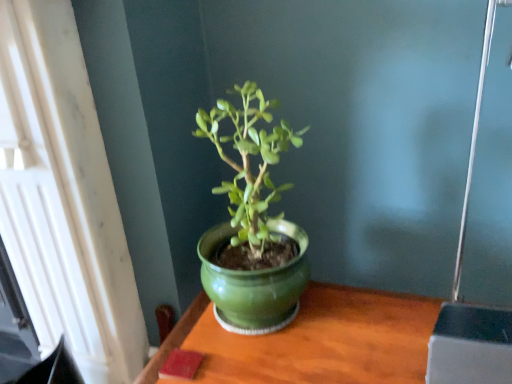
I want to click on glossy ceramic pot at center, so click(252, 225).

What are the coordinates of `glossy ceramic pot at center` in the screenshot? It's located at (252, 225).

From a real-world perspective, is white textured window at upper left above or below green ceramic table at center?

white textured window at upper left is above green ceramic table at center.

Could you tell me if white textured window at upper left is turned towards green ceramic table at center?

No, white textured window at upper left is not turned towards green ceramic table at center.

Is point (57, 115) more distant than point (419, 366)?

Yes, point (57, 115) is behind point (419, 366).

Would you say white textured window at upper left contains green ceramic table at center?

No, green ceramic table at center is located outside of white textured window at upper left.

Is glossy ceramic pot at center positioned beyond the bounds of white textured window at upper left?

glossy ceramic pot at center is positioned outside white textured window at upper left.

Which is in front, glossy ceramic pot at center or white textured window at upper left?

white textured window at upper left.

Is glossy ceramic pot at center not close to white textured window at upper left?

No.

Considering the sizes of glossy ceramic pot at center and white textured window at upper left in the image, is glossy ceramic pot at center taller or shorter than white textured window at upper left?

Considering their sizes, glossy ceramic pot at center has less height than white textured window at upper left.

Where is `houseplant that appears above the green ceramic table at center (from the image's perspective)`? houseplant that appears above the green ceramic table at center (from the image's perspective) is located at coordinates (252, 225).

Based on their positions, is glossy ceramic pot at center located to the left or right of green ceramic table at center?

glossy ceramic pot at center is positioned on green ceramic table at center's left side.

Which is further, (210,139) or (319,300)?

The point (319,300) is farther from the camera.

Is green ceramic table at center surrounded by glossy ceramic pot at center?

No, glossy ceramic pot at center does not contain green ceramic table at center.

Is glossy ceramic pot at center inside green ceramic table at center?

No, green ceramic table at center does not contain glossy ceramic pot at center.

From a real-world perspective, which is physically above, green ceramic table at center or glossy ceramic pot at center?

From a 3D spatial view, glossy ceramic pot at center is above.

From the image's perspective, between green ceramic table at center and glossy ceramic pot at center, which one is located above?

glossy ceramic pot at center, from the image's perspective.

How many degrees apart are the facing directions of green ceramic table at center and glossy ceramic pot at center?

The angular difference between green ceramic table at center and glossy ceramic pot at center is 0.811 degrees.

Can you see white textured window at upper left touching glossy ceramic pot at center?

There is a gap between white textured window at upper left and glossy ceramic pot at center.

Which object is wider, white textured window at upper left or glossy ceramic pot at center?

With larger width is white textured window at upper left.

Locate an element on the screen. window in front of the glossy ceramic pot at center is located at coordinates (63, 197).

Is green ceramic table at center facing away from white textured window at upper left?

green ceramic table at center does not have its back to white textured window at upper left.

How different are the orientations of green ceramic table at center and white textured window at upper left in degrees?

The facing directions of green ceramic table at center and white textured window at upper left are 0.0884 degrees apart.

Is green ceramic table at center in contact with white textured window at upper left?

green ceramic table at center and white textured window at upper left are clearly separated.

Where is `window positioned vertically above the green ceramic table at center (from a real-world perspective)`? The image size is (512, 384). window positioned vertically above the green ceramic table at center (from a real-world perspective) is located at coordinates (63, 197).

This screenshot has height=384, width=512. In order to click on window located above the green ceramic table at center (from the image's perspective) in this screenshot , I will do `click(63, 197)`.

Find the location of `houseplant behind the white textured window at upper left`. houseplant behind the white textured window at upper left is located at coordinates (252, 225).

Looking at the image, which one is located further to white textured window at upper left, glossy ceramic pot at center or green ceramic table at center?

green ceramic table at center lies further to white textured window at upper left than the other object.

From the image, which object appears to be nearer to green ceramic table at center, glossy ceramic pot at center or white textured window at upper left?

glossy ceramic pot at center lies closer to green ceramic table at center than the other object.

Looking at this image, based on their spatial positions, is white textured window at upper left or glossy ceramic pot at center further from green ceramic table at center?

The object further to green ceramic table at center is white textured window at upper left.

In the scene shown: Based on their spatial positions, is green ceramic table at center or glossy ceramic pot at center closer to white textured window at upper left?

glossy ceramic pot at center lies closer to white textured window at upper left than the other object.

Estimate the real-world distances between objects in this image. Which object is further from glossy ceramic pot at center, white textured window at upper left or green ceramic table at center?

Among the two, white textured window at upper left is located further to glossy ceramic pot at center.

Which object lies further to the anchor point glossy ceramic pot at center, green ceramic table at center or white textured window at upper left?

Among the two, white textured window at upper left is located further to glossy ceramic pot at center.

This screenshot has height=384, width=512. Identify the location of houseplant located between white textured window at upper left and green ceramic table at center in the left-right direction. (252, 225).